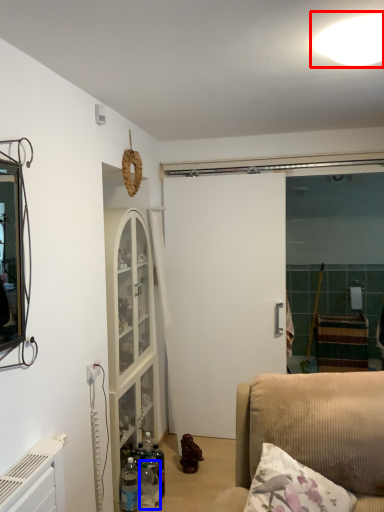
Question: Which object is further to the camera taking this photo, light (highlighted by a red box) or bottle (highlighted by a blue box)?

Choices:
 (A) light
 (B) bottle

Answer: (B)